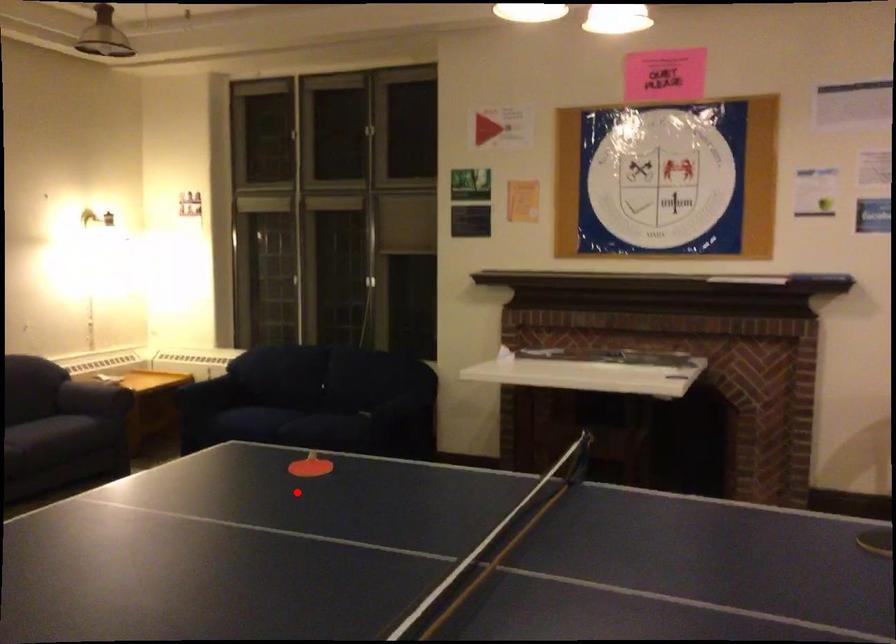
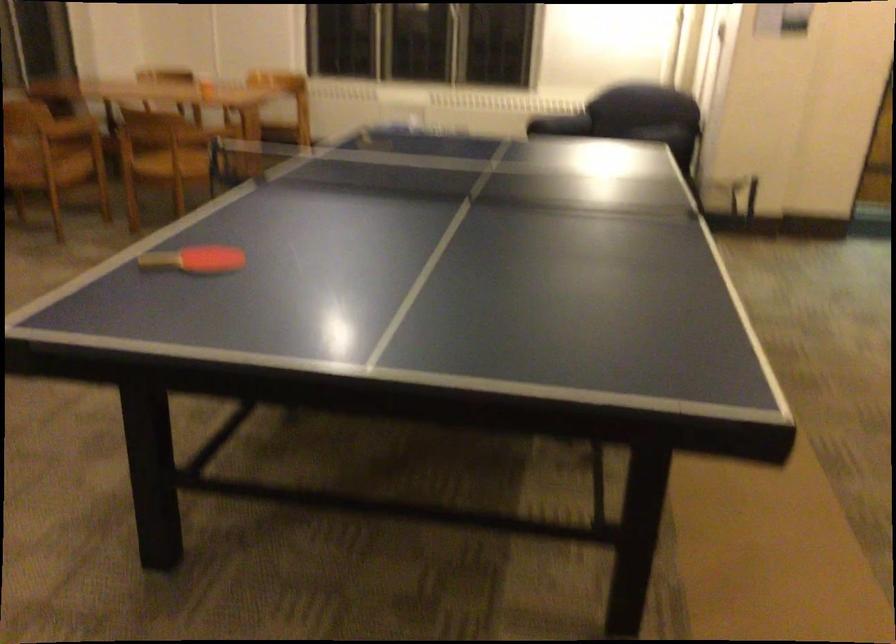
Question: I am providing you with two images of the same scene from different viewpoints. A red point is shown in image1. For the corresponding object point in image2, is it positioned nearer or farther from the camera?

Choices:
 (A) Nearer
 (B) Farther

Answer: (A)